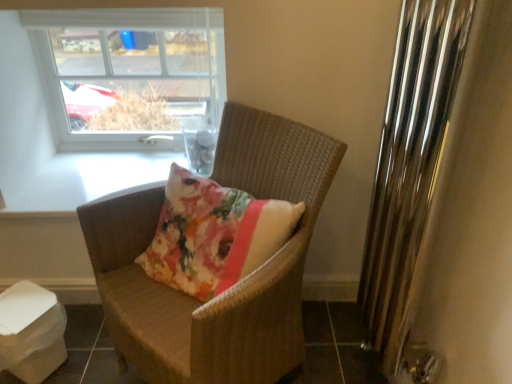
Question: Is woven brown chair at center spatially inside clear glass window at upper left, or outside of it?

Choices:
 (A) outside
 (B) inside

Answer: (A)

Question: Looking at their shapes, would you say woven brown chair at center is wider or thinner than clear glass window at upper left?

Choices:
 (A) thin
 (B) wide

Answer: (B)

Question: Which object is the closest to the clear glass window at upper left?

Choices:
 (A) woven brown chair at center
 (B) polished chrome radiator at right

Answer: (A)

Question: Estimate the real-world distances between objects in this image. Which object is closer to the polished chrome radiator at right?

Choices:
 (A) woven brown chair at center
 (B) clear glass window at upper left

Answer: (A)